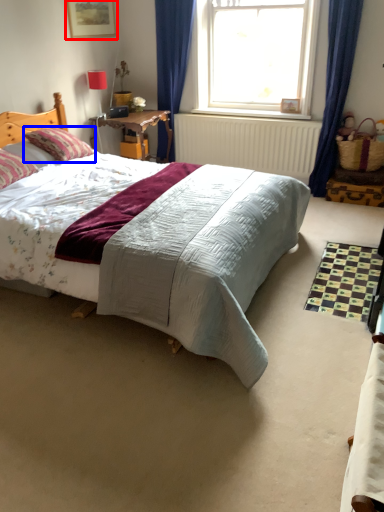
Question: Which point is closer to the camera, picture frame (highlighted by a red box) or pillow (highlighted by a blue box)?

Choices:
 (A) picture frame
 (B) pillow

Answer: (B)